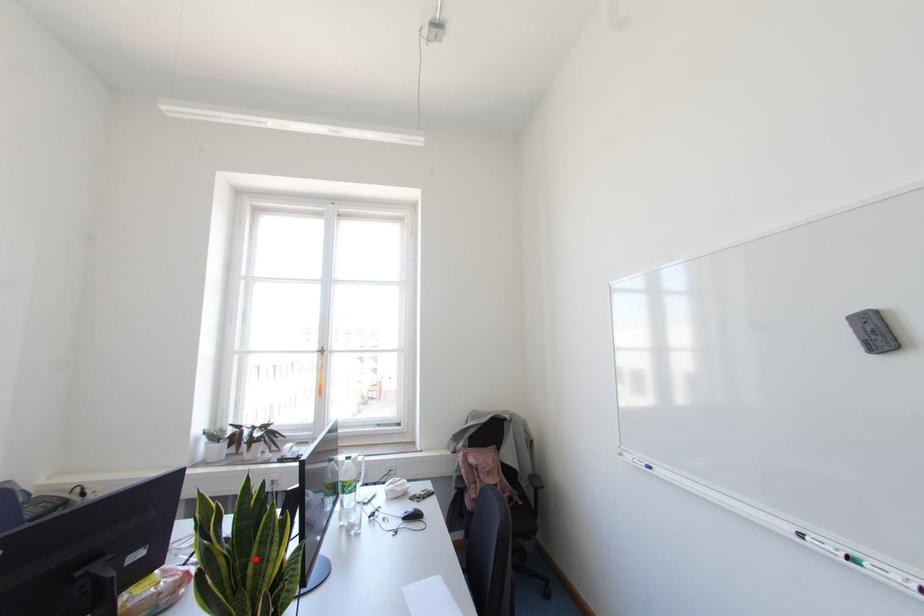
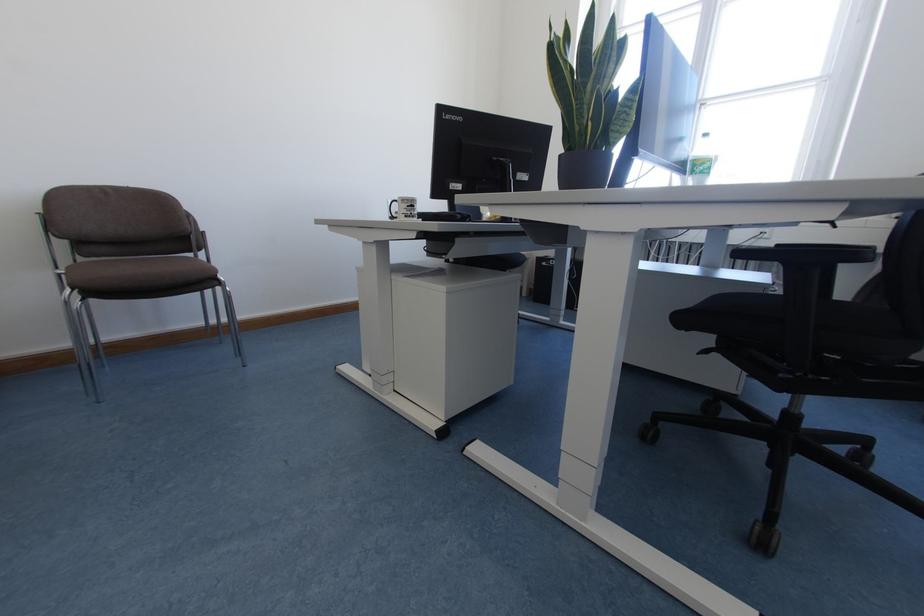
In the second image, find the point that corresponds to the highlighted location in the first image.

(593, 77)